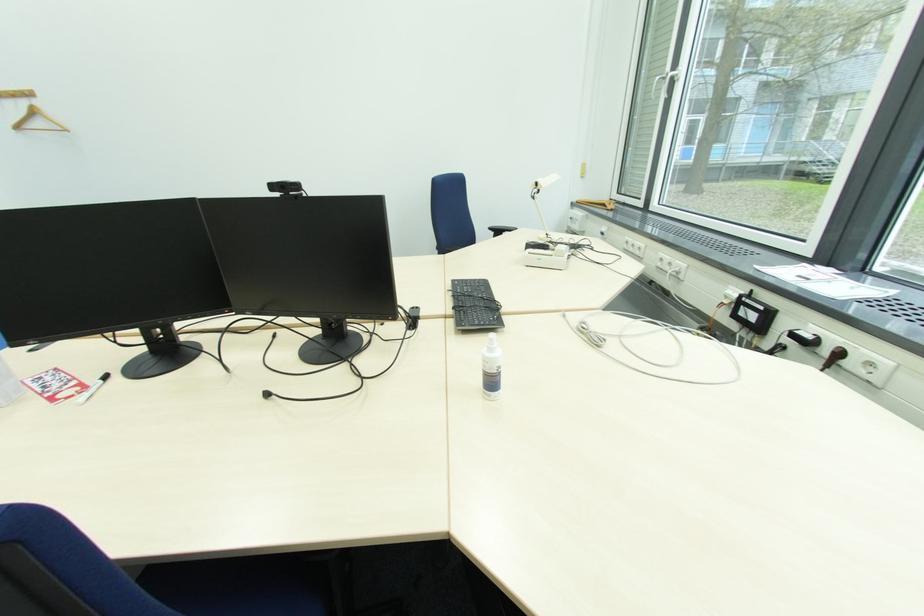
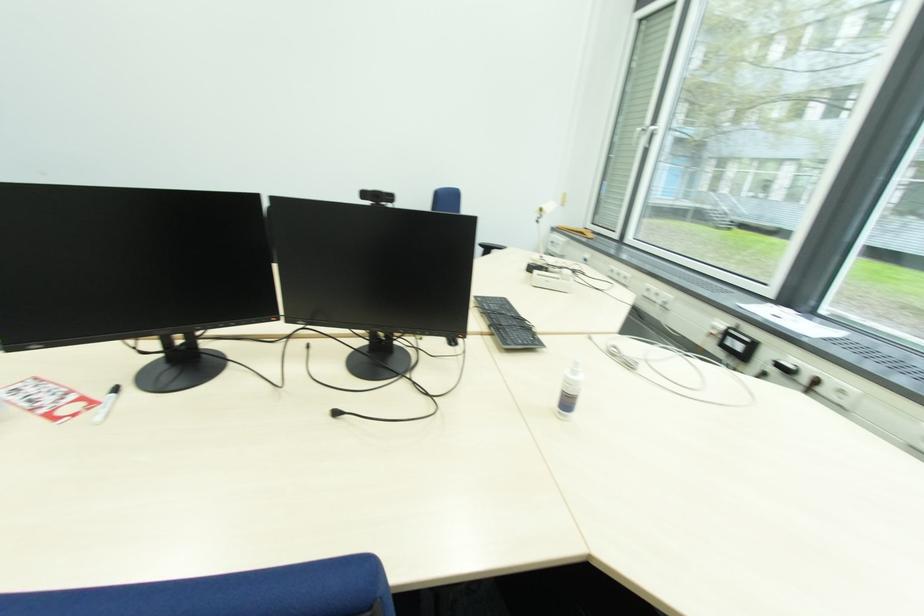
Question: The camera is either moving clockwise (left) or counter-clockwise (right) around the object. The first image is from the beginning of the video and the second image is from the end. Is the camera moving left or right when shooting the video?

Choices:
 (A) Left
 (B) Right

Answer: (A)